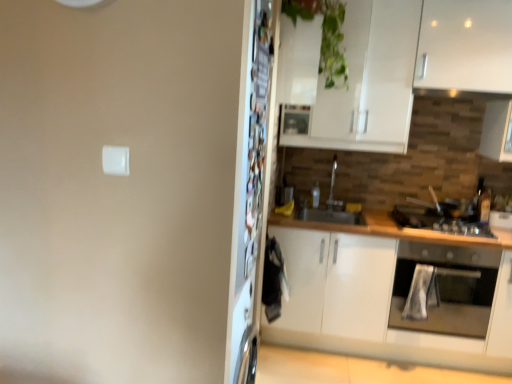
Find the location of a particular element. green glossy plant at upper center is located at coordinates (324, 35).

Locate an element on the screen. metallic refrigerator at center is located at coordinates (250, 186).

Which of these two, green glossy plant at upper center or metallic refrigerator at center, is bigger?

Bigger between the two is green glossy plant at upper center.

From the image's perspective, which object appears higher, green glossy plant at upper center or metallic refrigerator at center?

green glossy plant at upper center.

Is metallic refrigerator at center surrounded by green glossy plant at upper center?

That's incorrect, metallic refrigerator at center is not inside green glossy plant at upper center.

Is point (305, 3) in front of point (271, 15)?

That is False.

Is metallic silver exhaust hood at upper right looking in the opposite direction of stainless steel oven at right?

No.

From a real-world perspective, between metallic silver exhaust hood at upper right and stainless steel oven at right, who is vertically higher?

metallic silver exhaust hood at upper right is physically above.

Can you confirm if metallic silver exhaust hood at upper right is bigger than stainless steel oven at right?

Incorrect, metallic silver exhaust hood at upper right is not larger than stainless steel oven at right.

Considering the sizes of objects metallic silver exhaust hood at upper right and stainless steel oven at right in the image provided, who is taller, metallic silver exhaust hood at upper right or stainless steel oven at right?

With more height is stainless steel oven at right.

From the picture: Considering their positions, is white matte cabinet at right located in front of or behind black matte gas stove at right?

white matte cabinet at right is in front of black matte gas stove at right.

Can you confirm if white matte cabinet at right is taller than black matte gas stove at right?

Indeed, white matte cabinet at right has a greater height compared to black matte gas stove at right.

Is point (353, 336) closer to viewer compared to point (490, 234)?

That is False.

Measure the distance from white matte cabinet at right to black matte gas stove at right.

19.31 inches.

Considering the relative sizes of metallic refrigerator at center and white matte cabinet at right in the image provided, is metallic refrigerator at center bigger than white matte cabinet at right?

Incorrect, metallic refrigerator at center is not larger than white matte cabinet at right.

Considering the positions of objects metallic refrigerator at center and white matte cabinet at right in the image provided, who is more to the right, metallic refrigerator at center or white matte cabinet at right?

Positioned to the right is white matte cabinet at right.

From the image's perspective, is metallic refrigerator at center on white matte cabinet at right?

Indeed, from the image's perspective, metallic refrigerator at center is shown above white matte cabinet at right.

Which is behind, black matte gas stove at right or metallic refrigerator at center?

black matte gas stove at right is further from the camera.

Is black matte gas stove at right not near metallic refrigerator at center?

Yes, black matte gas stove at right and metallic refrigerator at center are quite far apart.

Does black matte gas stove at right contain metallic refrigerator at center?

No, metallic refrigerator at center is not inside black matte gas stove at right.

Based on the photo, which of these two, black matte gas stove at right or metallic refrigerator at center, is wider?

Wider between the two is black matte gas stove at right.

Is point (474, 316) behind point (337, 332)?

That is False.

Is stainless steel oven at right aimed at white matte cabinet at right?

Yes, stainless steel oven at right faces towards white matte cabinet at right.

Could white matte cabinet at right be considered to be inside stainless steel oven at right?

No, white matte cabinet at right is not surrounded by stainless steel oven at right.

In order to click on exhaust hood behind the stainless steel oven at right in this screenshot , I will do pos(461,94).

Does point (403, 327) lie in front of point (503, 93)?

No, it is not.

Looking at their sizes, would you say stainless steel oven at right is wider or thinner than metallic silver exhaust hood at upper right?

Considering their sizes, stainless steel oven at right looks broader than metallic silver exhaust hood at upper right.

Which of these two, stainless steel oven at right or metallic silver exhaust hood at upper right, stands shorter?

metallic silver exhaust hood at upper right.

Identify the location of fridge lying in front of the green glossy plant at upper center. This screenshot has width=512, height=384. (250, 186).

You are a GUI agent. You are given a task and a screenshot of the screen. Output one action in this format:
    pyautogui.click(x=<x>, y=<y>)
    Task: Click on the exhaust hood above the stainless steel oven at right (from the image's perspective)
    
    Given the screenshot: What is the action you would take?
    pyautogui.click(x=461, y=94)

Looking at this image, looking at the image, which one is located closer to green glossy plant at upper center, metallic refrigerator at center or black matte gas stove at right?

Based on the image, metallic refrigerator at center appears to be nearer to green glossy plant at upper center.

From the image, which object appears to be farther from metallic silver exhaust hood at upper right, black matte gas stove at right or green glossy plant at upper center?

green glossy plant at upper center lies further to metallic silver exhaust hood at upper right than the other object.

From the picture: Estimate the real-world distances between objects in this image. Which object is closer to black matte gas stove at right, metallic refrigerator at center or green glossy plant at upper center?

green glossy plant at upper center lies closer to black matte gas stove at right than the other object.

Which object lies nearer to the anchor point metallic refrigerator at center, white matte cabinet at right or black matte gas stove at right?

Among the two, white matte cabinet at right is located nearer to metallic refrigerator at center.

Looking at the image, which one is located closer to stainless steel oven at right, metallic refrigerator at center or black matte gas stove at right?

black matte gas stove at right lies closer to stainless steel oven at right than the other object.

Consider the image. Looking at the image, which one is located further to green glossy plant at upper center, black matte gas stove at right or stainless steel oven at right?

Based on the image, stainless steel oven at right appears to be further to green glossy plant at upper center.

Which object lies further to the anchor point black matte gas stove at right, white matte cabinet at right or green glossy plant at upper center?

green glossy plant at upper center.

Which object lies nearer to the anchor point green glossy plant at upper center, white matte cabinet at right or metallic silver exhaust hood at upper right?

Among the two, metallic silver exhaust hood at upper right is located nearer to green glossy plant at upper center.

Identify the location of fridge between green glossy plant at upper center and stainless steel oven at right in the vertical direction. The width and height of the screenshot is (512, 384). (250, 186).

You are a GUI agent. You are given a task and a screenshot of the screen. Output one action in this format:
    pyautogui.click(x=<x>, y=<y>)
    Task: Click on the fridge between green glossy plant at upper center and white matte cabinet at right vertically
    This screenshot has width=512, height=384.
    Given the screenshot: What is the action you would take?
    pyautogui.click(x=250, y=186)

The image size is (512, 384). In order to click on cabinetry located between metallic refrigerator at center and stainless steel oven at right in the depth direction in this screenshot , I will do `click(387, 295)`.

I want to click on gas stove between green glossy plant at upper center and stainless steel oven at right from top to bottom, so click(438, 221).